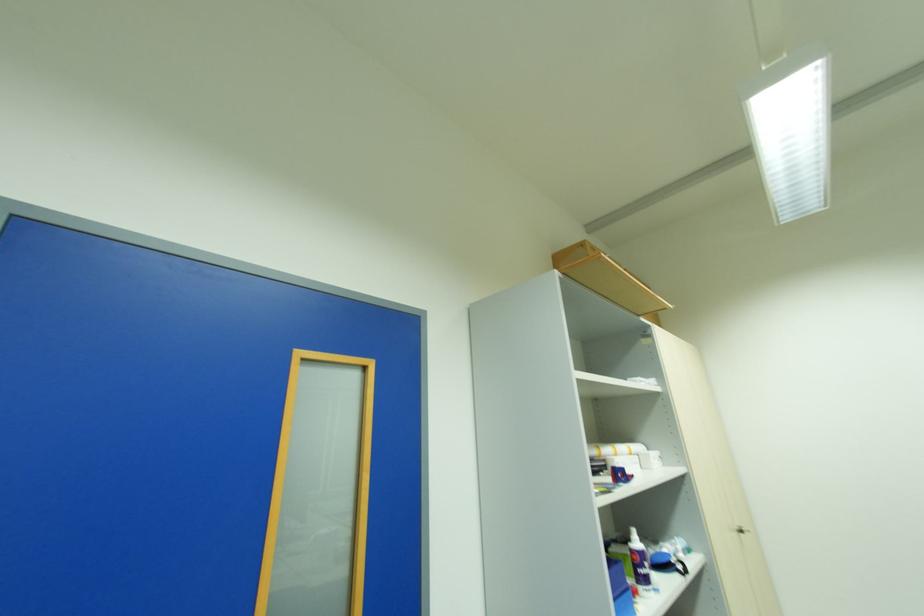
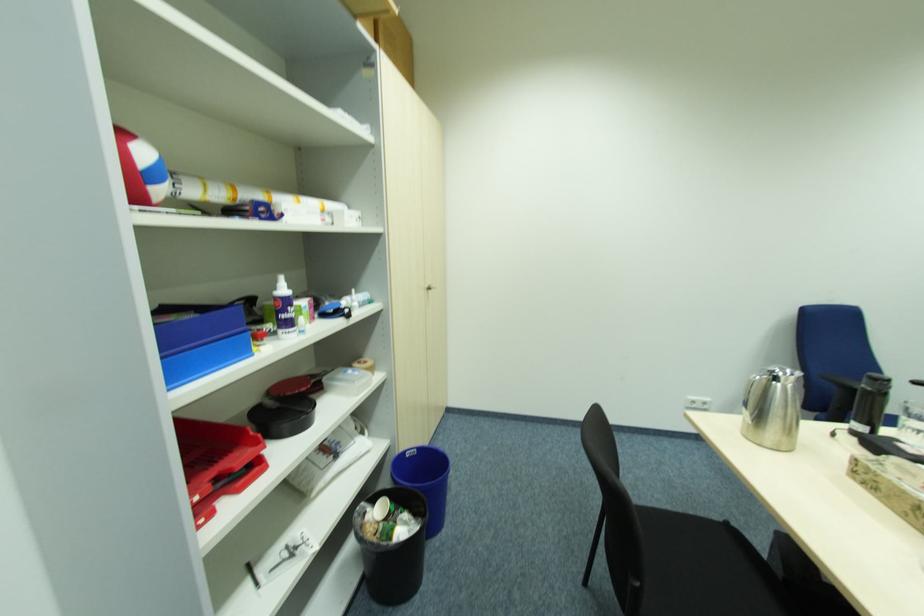
The images are taken continuously from a first-person perspective. In which direction is your viewpoint rotating?

The rotation direction of the camera is right-down.